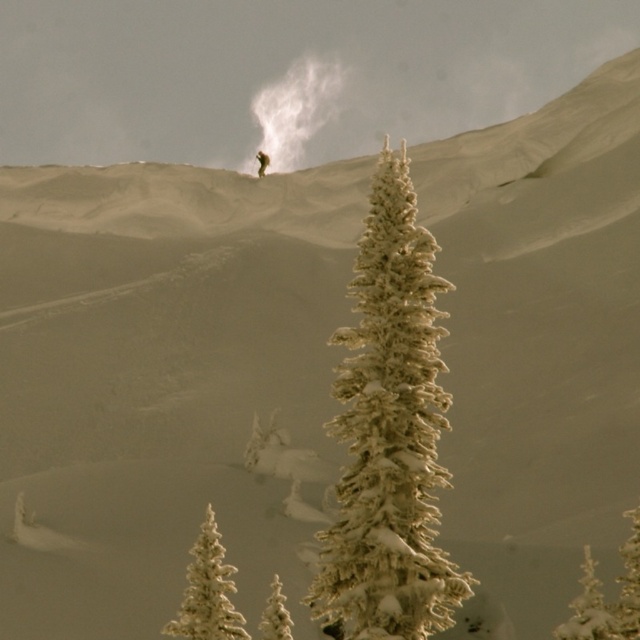
Is snow-covered pine tree at center thinner than white frosty tree at lower left?

No, snow-covered pine tree at center is not thinner than white frosty tree at lower left.

Does point (413, 403) lie in front of point (195, 579)?

Yes, it is.

Where is `snow-covered pine tree at center`? The image size is (640, 640). snow-covered pine tree at center is located at coordinates (388, 435).

In the scene shown: Who is positioned more to the right, white frosty tree at lower left or white frosty tree at lower center?

From the viewer's perspective, white frosty tree at lower center appears more on the right side.

Is point (240, 630) behind point (278, 630)?

Yes, it is behind point (278, 630).

Which is in front, point (198, 541) or point (273, 602)?

Point (198, 541) is more forward.

The image size is (640, 640). Identify the location of white frosty tree at lower left. (208, 592).

Does point (330, 570) come farther from viewer compared to point (266, 632)?

No, (330, 570) is closer to viewer.

Based on the photo, is snow-covered pine tree at center smaller than white frosty tree at lower center?

Incorrect, snow-covered pine tree at center is not smaller in size than white frosty tree at lower center.

This screenshot has width=640, height=640. What do you see at coordinates (388, 435) in the screenshot? I see `snow-covered pine tree at center` at bounding box center [388, 435].

At what (x,y) coordinates should I click in order to perform the action: click on snow-covered pine tree at center. Please return your answer as a coordinate pair (x, y). Looking at the image, I should click on (388, 435).